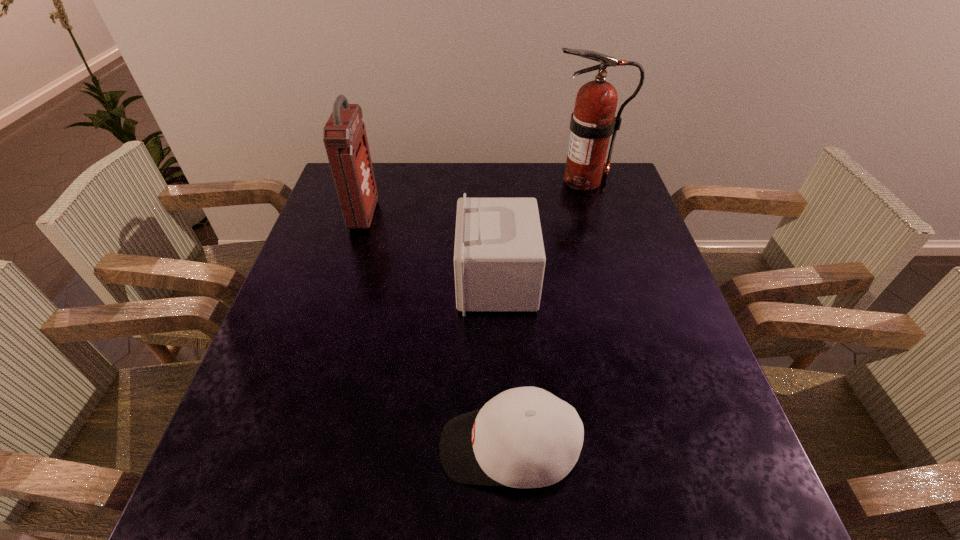
I want to click on vacant space located 0.140m at the nozzle of the farthest object, so click(x=503, y=180).

This screenshot has height=540, width=960. I want to click on free space located on the front-facing side of the taller first-aid kit, so click(x=395, y=215).

This screenshot has width=960, height=540. Find the location of `vacant area located 0.290m on the front-facing side of the nearer first-aid kit`. vacant area located 0.290m on the front-facing side of the nearer first-aid kit is located at coordinates (341, 281).

Locate an element on the screen. This screenshot has width=960, height=540. free space located on the front-facing side of the nearer first-aid kit is located at coordinates (394, 281).

The width and height of the screenshot is (960, 540). In order to click on vacant position located on the front-facing side of the nearer first-aid kit in this screenshot , I will do `click(316, 281)`.

Where is `free region located 0.350m on the front-facing side of the nearest object`? Image resolution: width=960 pixels, height=540 pixels. free region located 0.350m on the front-facing side of the nearest object is located at coordinates (245, 447).

This screenshot has width=960, height=540. What are the coordinates of `free region located 0.170m on the front-facing side of the nearest object` in the screenshot? It's located at (346, 447).

This screenshot has width=960, height=540. What are the coordinates of `free space located 0.050m on the front-facing side of the nearest object` in the screenshot? It's located at (412, 447).

Find the location of a particular element. fire extinguisher present at the far edge is located at coordinates (593, 121).

In order to click on the first-aid kit located at the far edge in this screenshot , I will do `click(344, 135)`.